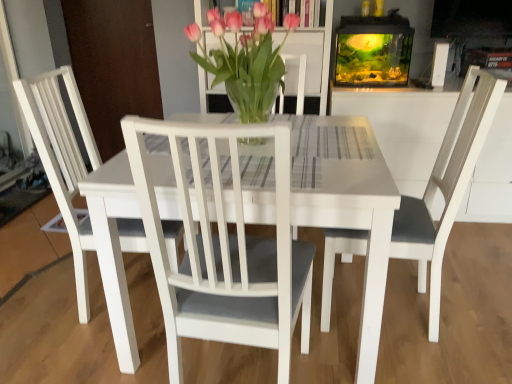
This screenshot has width=512, height=384. Identify the location of white matte chair at center, which is the first chair from left to right. (63, 160).

The width and height of the screenshot is (512, 384). What are the coordinates of `translucent glass vase at center` in the screenshot? It's located at (245, 60).

You are a GUI agent. You are given a task and a screenshot of the screen. Output one action in this format:
    pyautogui.click(x=<x>, y=<y>)
    Task: Click on the white matte chair at center, the 2th chair from the right
    Image resolution: width=512 pixels, height=384 pixels.
    Given the screenshot: What is the action you would take?
    pyautogui.click(x=63, y=160)

Is translucent glass vase at center far away from white matte chair at center, the 2th chair positioned from the left?

No, there isn't a large distance between translucent glass vase at center and white matte chair at center, the 2th chair positioned from the left.

Can you tell me how much translucent glass vase at center and white matte chair at center, the 1th chair positioned from the right, differ in facing direction?

9.93e-05 degrees separate the facing orientations of translucent glass vase at center and white matte chair at center, the 1th chair positioned from the right.

Which is in front, translucent glass vase at center or white matte chair at center, the 2th chair positioned from the left?

Positioned in front is white matte chair at center, the 2th chair positioned from the left.

Would you say white matte chair at center, the 2th chair positioned from the left, contains translucent glass vase at center?

Actually, translucent glass vase at center is outside white matte chair at center, the 2th chair positioned from the left.

Can you confirm if white matte chair at center, the 2th chair positioned from the left, is smaller than translucent glass vase at center?

No.

From the image's perspective, would you say white matte chair at center, the 1th chair positioned from the right, is positioned over translucent glass vase at center?

Actually, white matte chair at center, the 1th chair positioned from the right, appears below translucent glass vase at center in the image.

Consider the image. Is white matte chair at center, the 2th chair from the right, situated inside white matte chair at center, the 1th chair positioned from the right, or outside?

white matte chair at center, the 2th chair from the right, is located beyond the bounds of white matte chair at center, the 1th chair positioned from the right.

Between white matte chair at center, the 2th chair from the right, and white matte chair at center, the 1th chair positioned from the right, which one appears on the right side from the viewer's perspective?

From the viewer's perspective, white matte chair at center, the 1th chair positioned from the right, appears more on the right side.

How different are the orientations of white matte chair at center, the 2th chair from the right, and white matte chair at center, the 2th chair positioned from the left, in degrees?

93.8 degrees separate the facing orientations of white matte chair at center, the 2th chair from the right, and white matte chair at center, the 2th chair positioned from the left.

Considering the relative sizes of white matte chair at center, the 2th chair from the right, and white matte chair at center, the 1th chair positioned from the right, in the image provided, is white matte chair at center, the 2th chair from the right, taller than white matte chair at center, the 1th chair positioned from the right,?

Correct, white matte chair at center, the 2th chair from the right, is much taller as white matte chair at center, the 1th chair positioned from the right.

The height and width of the screenshot is (384, 512). In order to click on chair located above the white matte chair at center, the 2th chair positioned from the left (from a real-world perspective) in this screenshot , I will do `click(63, 160)`.

Would you say white matte chair at center, which is the first chair from left to right, is part of white matte chair at center, the 2th chair positioned from the left,'s contents?

No, white matte chair at center, which is the first chair from left to right, is located outside of white matte chair at center, the 2th chair positioned from the left.

Does point (129, 236) lie in front of point (244, 77)?

No, (129, 236) is further to viewer.

Identify the location of houseplant above the white matte chair at center, the 2th chair from the right (from a real-world perspective). (245, 60).

Considering the sizes of objects white matte chair at center, the 2th chair from the right, and translucent glass vase at center in the image provided, who is wider, white matte chair at center, the 2th chair from the right, or translucent glass vase at center?

white matte chair at center, the 2th chair from the right, is wider.

Identify the location of houseplant lying in front of the white matte chair at center, which is the first chair from left to right. The width and height of the screenshot is (512, 384). (245, 60).

From the image's perspective, is translucent glass vase at center under white matte chair at center, the 2th chair from the right?

Incorrect, from the image's perspective, translucent glass vase at center is higher than white matte chair at center, the 2th chair from the right.

Is white matte chair at center, the 2th chair from the right, surrounded by translucent glass vase at center?

Actually, white matte chair at center, the 2th chair from the right, is outside translucent glass vase at center.

From the picture: Between translucent glass vase at center and white matte chair at center, which is the first chair from left to right, which one appears on the right side from the viewer's perspective?

From the viewer's perspective, translucent glass vase at center appears more on the right side.

From a real-world perspective, count 2nd chairs downward from the translucent glass vase at center and point to it. Please provide its 2D coordinates.

[(224, 248)]

In order to click on chair in front of the translucent glass vase at center in this screenshot , I will do `click(224, 248)`.

From the image, which object appears to be farther from white matte chair at center, the 2th chair positioned from the left, white matte chair at center, the 2th chair from the right, or translucent glass vase at center?

white matte chair at center, the 2th chair from the right, is further to white matte chair at center, the 2th chair positioned from the left.

Considering their positions, is white matte chair at center, the 1th chair positioned from the right, positioned further to translucent glass vase at center than white matte chair at center, which is the first chair from left to right?

Based on the image, white matte chair at center, which is the first chair from left to right, appears to be further to translucent glass vase at center.

Estimate the real-world distances between objects in this image. Which object is closer to white matte chair at center, which is the first chair from left to right, white matte chair at center, the 1th chair positioned from the right, or translucent glass vase at center?

Based on the image, translucent glass vase at center appears to be nearer to white matte chair at center, which is the first chair from left to right.

From the image, which object appears to be nearer to white matte chair at center, the 2th chair from the right, translucent glass vase at center or white matte chair at center, the 1th chair positioned from the right?

translucent glass vase at center is closer to white matte chair at center, the 2th chair from the right.

When comparing their distances from translucent glass vase at center, does white matte chair at center, the 2th chair from the right, or white matte chair at center, the 2th chair positioned from the left, seem further?

Based on the image, white matte chair at center, the 2th chair from the right, appears to be further to translucent glass vase at center.

Which object lies further to the anchor point white matte chair at center, the 1th chair positioned from the right, translucent glass vase at center or white matte chair at center, which is the first chair from left to right?

Among the two, white matte chair at center, which is the first chair from left to right, is located further to white matte chair at center, the 1th chair positioned from the right.

The height and width of the screenshot is (384, 512). I want to click on houseplant between white matte chair at center, which is the first chair from left to right, and white matte chair at center, the 2th chair positioned from the left, from left to right, so point(245,60).